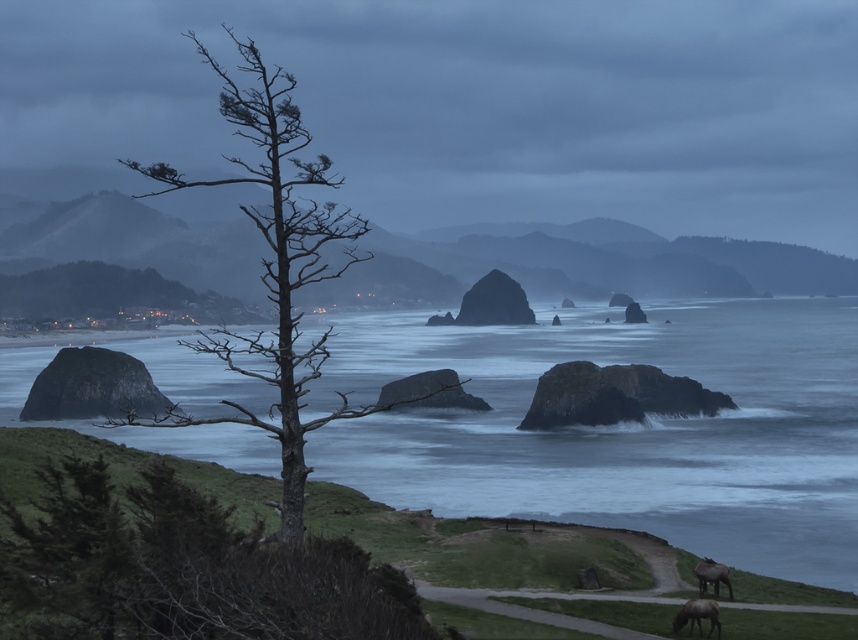
You are an artist trying to sketch this coastal scene. You want to place the brown matte horse at lower right in your drawing. Where should you position it relative to the bare wood tree at left?

The brown matte horse at lower right should be placed to the right of the bare wood tree at left since the bare wood tree at left is positioned on the left side of the brown matte horse at lower right.